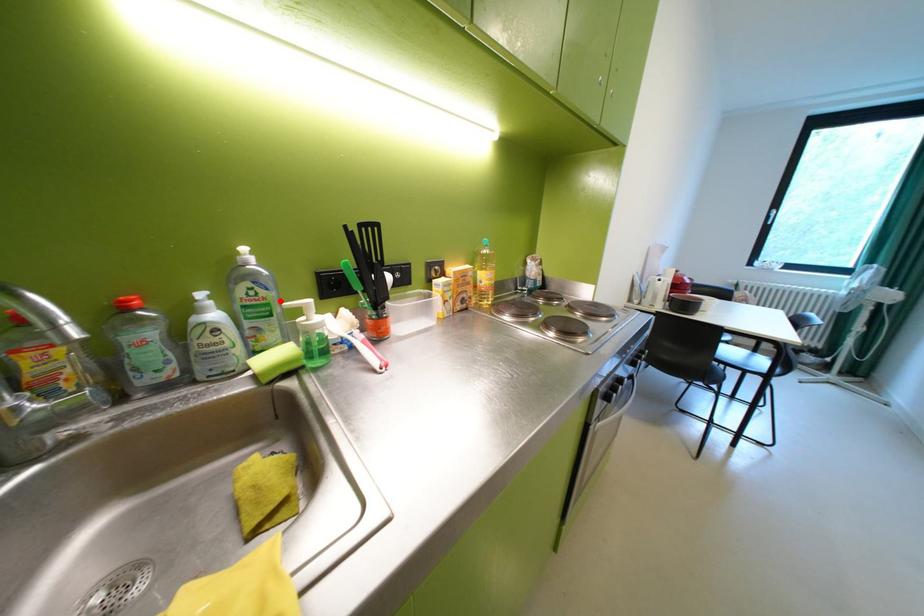
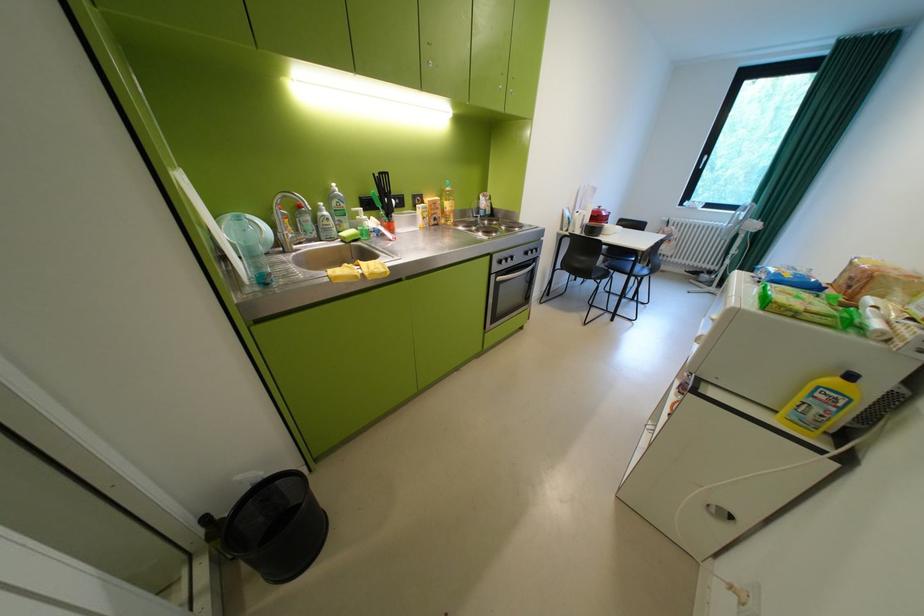
In the second image, find the point that corresponds to the highlighted location in the first image.

(356, 209)